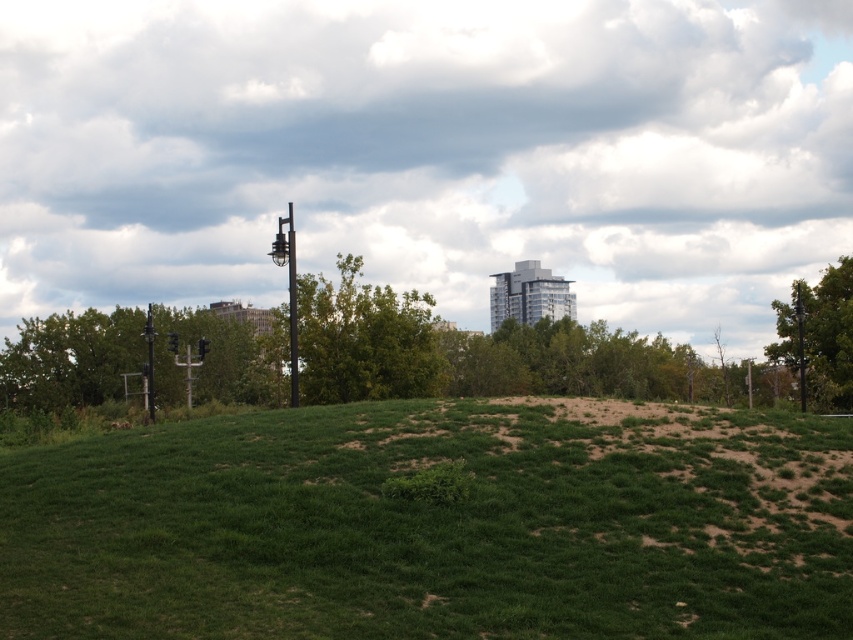
You are standing at the base of the metallic pole at center and want to walk towards the green leafy tree at right. Which direction should you face to walk directly towards it?

You should face to the right because the green leafy tree at right is located to the right of the metallic pole at center.

You are a hiker planning to set up a tent on the green grassy hill at center and want to ensure there is enough space. Considering the presence of the green leafy tree at left, which object is shorter and thus more suitable for tent placement?

The green grassy hill at center is shorter than the green leafy tree at left, making it more suitable for tent placement as the tree might obstruct space.

You are standing at the point marked as point (819, 337) in the image. Looking around, you see a grassy hill with patches of brown soil and several lampposts. Which direction should you walk to reach the nearest lamppost?

The point (819, 337) is located on the green leafy tree at right. Since the lampposts are in the midground behind the tree, you should walk towards the lampposts by moving towards the center of the image where they are positioned.